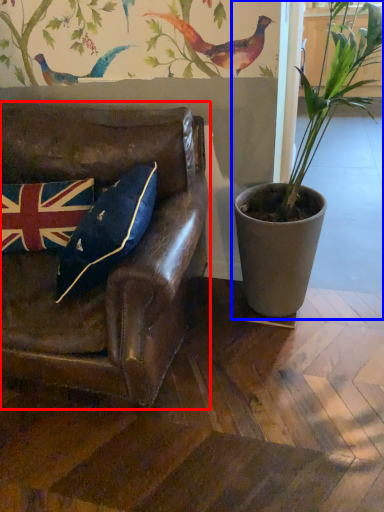
Question: Among these objects, which one is farthest to the camera, chair (highlighted by a red box) or houseplant (highlighted by a blue box)?

Choices:
 (A) chair
 (B) houseplant

Answer: (B)